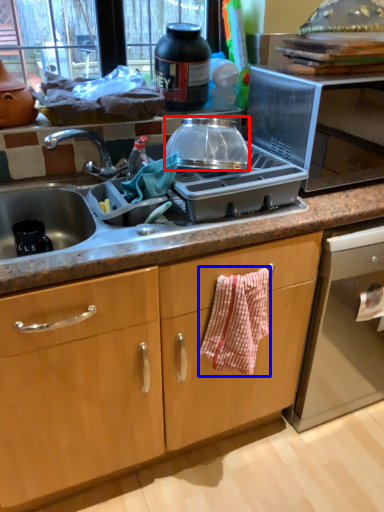
Question: Which object appears closest to the camera in this image, kitchen appliance (highlighted by a red box) or hand towel (highlighted by a blue box)?

Choices:
 (A) kitchen appliance
 (B) hand towel

Answer: (B)